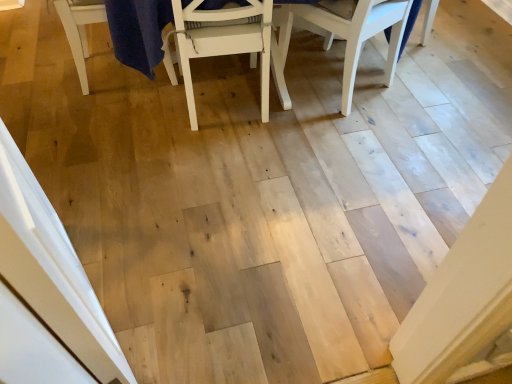
Identify the location of white matte chair at center, which is the first chair from left to right. (220, 42).

This screenshot has height=384, width=512. What do you see at coordinates (220, 42) in the screenshot?
I see `white matte chair at center, placed as the 2th chair when sorted from right to left` at bounding box center [220, 42].

This screenshot has width=512, height=384. What do you see at coordinates (340, 37) in the screenshot? I see `white wood chair at upper right, marked as the 2th chair in a left-to-right arrangement` at bounding box center [340, 37].

This screenshot has width=512, height=384. I want to click on white wood chair at upper right, which is the first chair in right-to-left order, so click(x=340, y=37).

In order to face white wood chair at upper right, which is the first chair in right-to-left order, should I rotate leftwards or rightwards?

A 13.790 degree turn to the right will do.

You are a GUI agent. You are given a task and a screenshot of the screen. Output one action in this format:
    pyautogui.click(x=<x>, y=<y>)
    Task: Click on the white matte chair at center, which is the first chair from left to right
    The height and width of the screenshot is (384, 512).
    Given the screenshot: What is the action you would take?
    pyautogui.click(x=220, y=42)

In the scene shown: Would you say white wood chair at upper right, marked as the 2th chair in a left-to-right arrangement, is to the left or to the right of white matte chair at center, which is the first chair from left to right, in the picture?

Based on their positions, white wood chair at upper right, marked as the 2th chair in a left-to-right arrangement, is located to the right of white matte chair at center, which is the first chair from left to right.

Who is more distant, white wood chair at upper right, which is the first chair in right-to-left order, or white matte chair at center, which is the first chair from left to right?

white wood chair at upper right, which is the first chair in right-to-left order, is further from the camera.

Which is closer, (281, 25) or (175, 42)?

Point (281, 25) appears to be farther away from the viewer than point (175, 42).

From the image's perspective, which is above, white wood chair at upper right, marked as the 2th chair in a left-to-right arrangement, or white matte chair at center, placed as the 2th chair when sorted from right to left?

From the image's view, white wood chair at upper right, marked as the 2th chair in a left-to-right arrangement, is above.

From a real-world perspective, relative to white matte chair at center, which is the first chair from left to right, is white wood chair at upper right, marked as the 2th chair in a left-to-right arrangement, vertically above or below?

white wood chair at upper right, marked as the 2th chair in a left-to-right arrangement, is situated lower than white matte chair at center, which is the first chair from left to right, in the real world.

Considering the sizes of objects white wood chair at upper right, marked as the 2th chair in a left-to-right arrangement, and white matte chair at center, which is the first chair from left to right, in the image provided, who is thinner, white wood chair at upper right, marked as the 2th chair in a left-to-right arrangement, or white matte chair at center, which is the first chair from left to right,?

white wood chair at upper right, marked as the 2th chair in a left-to-right arrangement.

Who is taller, white wood chair at upper right, marked as the 2th chair in a left-to-right arrangement, or white matte chair at center, placed as the 2th chair when sorted from right to left?

With more height is white matte chair at center, placed as the 2th chair when sorted from right to left.

Is white wood chair at upper right, which is the first chair in right-to-left order, bigger or smaller than white matte chair at center, which is the first chair from left to right?

white wood chair at upper right, which is the first chair in right-to-left order, is smaller than white matte chair at center, which is the first chair from left to right.

Is white matte chair at center, which is the first chair from left to right, completely or partially inside white wood chair at upper right, which is the first chair in right-to-left order?

Definitely not — white matte chair at center, which is the first chair from left to right, is not inside white wood chair at upper right, which is the first chair in right-to-left order.

Is there a large distance between white wood chair at upper right, marked as the 2th chair in a left-to-right arrangement, and white matte chair at center, which is the first chair from left to right?

No, there isn't a large distance between white wood chair at upper right, marked as the 2th chair in a left-to-right arrangement, and white matte chair at center, which is the first chair from left to right.

Is white wood chair at upper right, marked as the 2th chair in a left-to-right arrangement, facing away from white matte chair at center, placed as the 2th chair when sorted from right to left?

No, white matte chair at center, placed as the 2th chair when sorted from right to left, is not at the back of white wood chair at upper right, marked as the 2th chair in a left-to-right arrangement.

What's the angular difference between white wood chair at upper right, which is the first chair in right-to-left order, and white matte chair at center, which is the first chair from left to right,'s facing directions?

19.1 degrees separate the facing orientations of white wood chair at upper right, which is the first chair in right-to-left order, and white matte chair at center, which is the first chair from left to right.

Where is `chair that appears behind the white matte chair at center, placed as the 2th chair when sorted from right to left`? chair that appears behind the white matte chair at center, placed as the 2th chair when sorted from right to left is located at coordinates (340, 37).

Does white matte chair at center, placed as the 2th chair when sorted from right to left, appear on the right side of white wood chair at upper right, which is the first chair in right-to-left order?

No, white matte chair at center, placed as the 2th chair when sorted from right to left, is not to the right of white wood chair at upper right, which is the first chair in right-to-left order.

Which object is more forward, white matte chair at center, placed as the 2th chair when sorted from right to left, or white wood chair at upper right, marked as the 2th chair in a left-to-right arrangement?

Positioned in front is white matte chair at center, placed as the 2th chair when sorted from right to left.

Which point is more forward, [240,42] or [397,60]?

The point [240,42] is closer to the camera.

From the image's perspective, is white matte chair at center, placed as the 2th chair when sorted from right to left, above white wood chair at upper right, marked as the 2th chair in a left-to-right arrangement?

No, from the image's perspective, white matte chair at center, placed as the 2th chair when sorted from right to left, is not over white wood chair at upper right, marked as the 2th chair in a left-to-right arrangement.

From a real-world perspective, between white matte chair at center, which is the first chair from left to right, and white wood chair at upper right, which is the first chair in right-to-left order, who is vertically lower?

white wood chair at upper right, which is the first chair in right-to-left order, is physically lower.

Which of these two, white matte chair at center, placed as the 2th chair when sorted from right to left, or white wood chair at upper right, which is the first chair in right-to-left order, is wider?

white matte chair at center, placed as the 2th chair when sorted from right to left, is wider.

Who is shorter, white matte chair at center, placed as the 2th chair when sorted from right to left, or white wood chair at upper right, marked as the 2th chair in a left-to-right arrangement?

white wood chair at upper right, marked as the 2th chair in a left-to-right arrangement, is shorter.

Between white matte chair at center, which is the first chair from left to right, and white wood chair at upper right, which is the first chair in right-to-left order, which one has larger size?

With larger size is white matte chair at center, which is the first chair from left to right.

Is white matte chair at center, placed as the 2th chair when sorted from right to left, spatially inside white wood chair at upper right, which is the first chair in right-to-left order, or outside of it?

The correct answer is: outside.

Are white matte chair at center, placed as the 2th chair when sorted from right to left, and white wood chair at upper right, which is the first chair in right-to-left order, making contact?

white matte chair at center, placed as the 2th chair when sorted from right to left, and white wood chair at upper right, which is the first chair in right-to-left order, are clearly separated.

Is white matte chair at center, placed as the 2th chair when sorted from right to left, oriented towards white wood chair at upper right, marked as the 2th chair in a left-to-right arrangement?

No, white matte chair at center, placed as the 2th chair when sorted from right to left, does not turn towards white wood chair at upper right, marked as the 2th chair in a left-to-right arrangement.

Where is `chair to the right of white matte chair at center, placed as the 2th chair when sorted from right to left`? chair to the right of white matte chair at center, placed as the 2th chair when sorted from right to left is located at coordinates (340, 37).

At what (x,y) coordinates should I click in order to perform the action: click on chair below the white wood chair at upper right, which is the first chair in right-to-left order (from the image's perspective). Please return your answer as a coordinate pair (x, y). Image resolution: width=512 pixels, height=384 pixels. Looking at the image, I should click on (220, 42).

Locate an element on the screen. chair located on the right of white matte chair at center, which is the first chair from left to right is located at coordinates (340, 37).